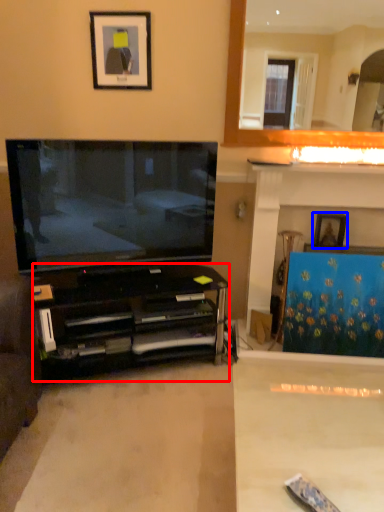
Question: Which of the following is the closest to the observer, cabinetry (highlighted by a red box) or picture frame (highlighted by a blue box)?

Choices:
 (A) cabinetry
 (B) picture frame

Answer: (A)